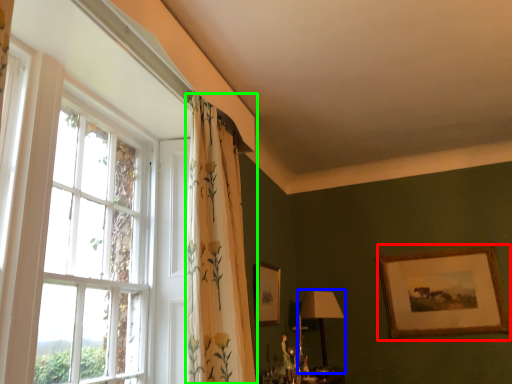
Question: Considering the real-world distances, which object is closest to picture frame (highlighted by a red box)? table lamp (highlighted by a blue box) or curtain (highlighted by a green box).

Choices:
 (A) table lamp
 (B) curtain

Answer: (A)